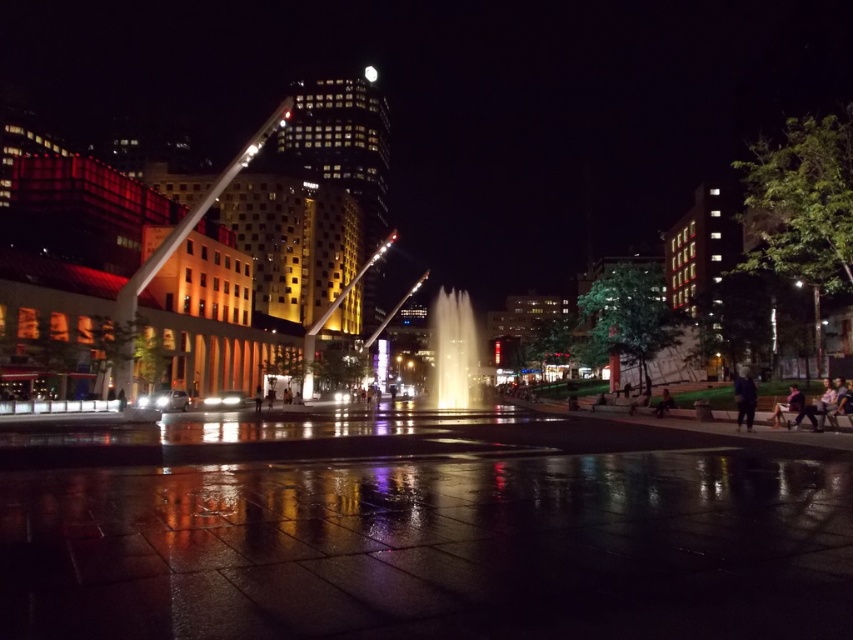
You are standing at the fountain in the center of the image and want to walk towards the point labeled as point (747, 400). As you move forward, will the point labeled as point (469, 352) come into your line of sight?

Since point (469, 352) is behind point (747, 400), it will not come into your line of sight as you walk towards point (747, 400).